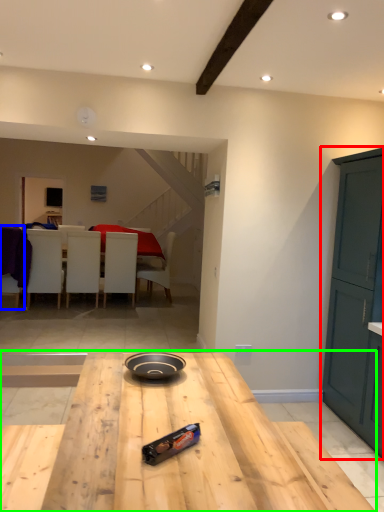
Question: Considering the real-world distances, which object is farthest from cabinetry (highlighted by a red box)? chair (highlighted by a blue box) or table (highlighted by a green box)?

Choices:
 (A) chair
 (B) table

Answer: (A)